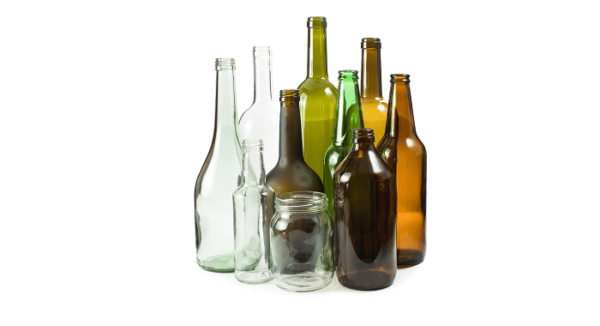
You are a GUI agent. You are given a task and a screenshot of the screen. Output one action in this format:
    pyautogui.click(x=<x>, y=<y>)
    Task: Click on the glass containers
    
    Given the screenshot: What is the action you would take?
    pyautogui.click(x=226, y=111), pyautogui.click(x=261, y=116), pyautogui.click(x=291, y=118), pyautogui.click(x=316, y=104), pyautogui.click(x=345, y=98), pyautogui.click(x=372, y=81), pyautogui.click(x=411, y=185), pyautogui.click(x=373, y=207), pyautogui.click(x=291, y=240), pyautogui.click(x=249, y=246)